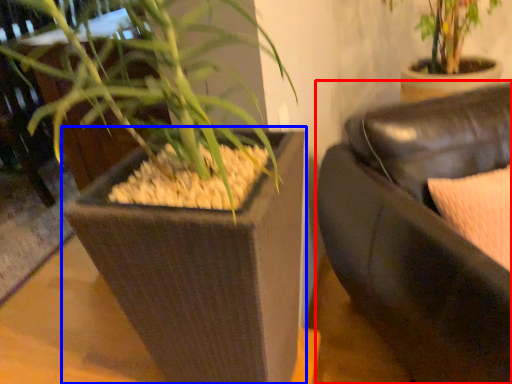
Question: Among these objects, which one is farthest to the camera, studio couch (highlighted by a red box) or flowerpot (highlighted by a blue box)?

Choices:
 (A) studio couch
 (B) flowerpot

Answer: (B)